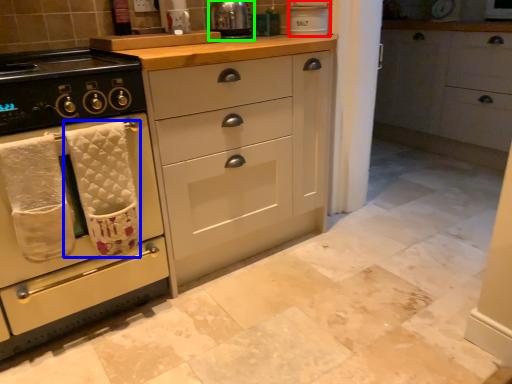
Question: Which object is the farthest from appliance (highlighted by a red box)? Choose among these: bath towel (highlighted by a blue box) or kitchen appliance (highlighted by a green box).

Choices:
 (A) bath towel
 (B) kitchen appliance

Answer: (A)